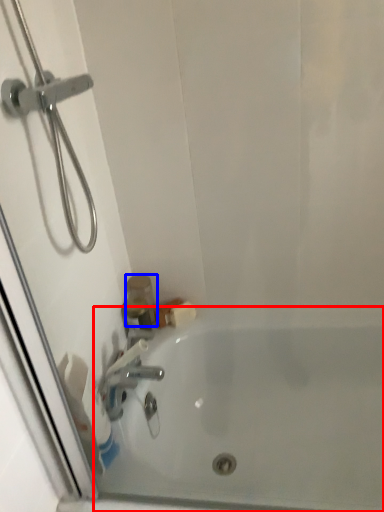
Question: Which of the following is the farthest to the observer, bathtub (highlighted by a red box) or toiletry (highlighted by a blue box)?

Choices:
 (A) bathtub
 (B) toiletry

Answer: (B)